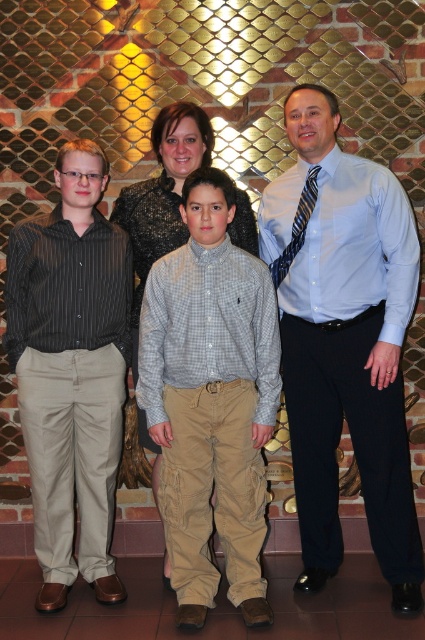
Question: Is striped cotton shirt at left bigger than blue striped tie at right?

Choices:
 (A) no
 (B) yes

Answer: (B)

Question: Can you confirm if light blue shirt at center is bigger than striped cotton shirt at left?

Choices:
 (A) no
 (B) yes

Answer: (B)

Question: Is striped cotton shirt at left above blue striped tie at right?

Choices:
 (A) no
 (B) yes

Answer: (A)

Question: Which object is the closest to the blue striped tie at right?

Choices:
 (A) light blue shirt at center
 (B) striped cotton shirt at left

Answer: (A)

Question: Among these objects, which one is nearest to the camera?

Choices:
 (A) gray checkered shirt at center
 (B) light blue shirt at center
 (C) blue striped tie at right

Answer: (A)

Question: Which point appears farthest from the camera in this image?

Choices:
 (A) pyautogui.click(x=220, y=444)
 (B) pyautogui.click(x=380, y=468)

Answer: (B)